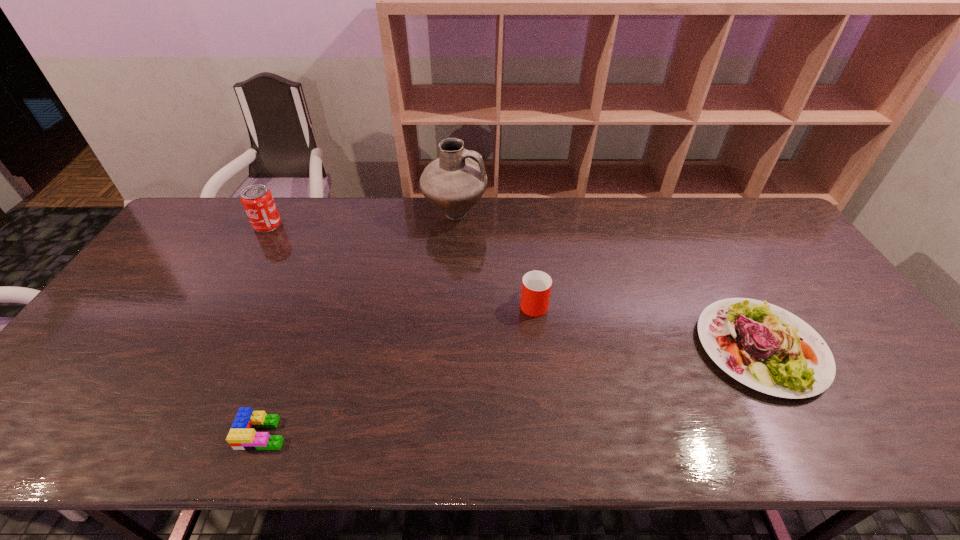
Image resolution: width=960 pixels, height=540 pixels. I want to click on the tallest object, so click(454, 183).

Where is `the third object from left to right`? the third object from left to right is located at coordinates (454, 183).

This screenshot has width=960, height=540. I want to click on the leftmost object, so click(x=257, y=200).

Identify the location of can. (257, 200).

Where is `the third shortest object`? the third shortest object is located at coordinates (536, 285).

Find the location of a particular element. Image resolution: width=960 pixels, height=540 pixels. the second object from right to left is located at coordinates (536, 285).

Find the location of a particular element. This screenshot has height=540, width=960. salad plate is located at coordinates (765, 347).

You are a GUI agent. You are given a task and a screenshot of the screen. Output one action in this format:
    pyautogui.click(x=<x>, y=<y>)
    Task: Click on the rightmost object
    
    Given the screenshot: What is the action you would take?
    pyautogui.click(x=765, y=347)

Identify the location of the nearest object. Image resolution: width=960 pixels, height=540 pixels. (242, 436).

Where is `the shortest object`? Image resolution: width=960 pixels, height=540 pixels. the shortest object is located at coordinates (242, 436).